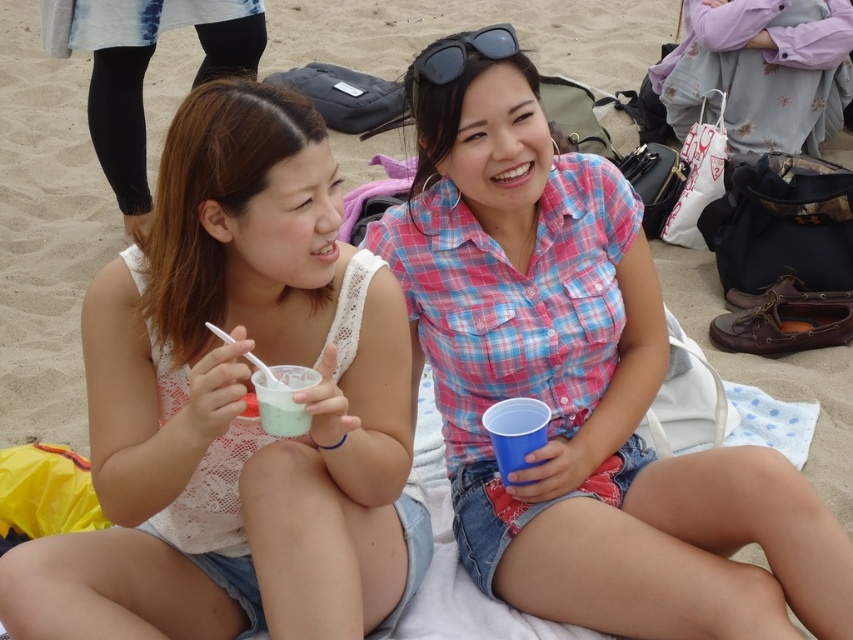
Question: Which point is farther to the camera?

Choices:
 (A) (148, 60)
 (B) (444, 65)

Answer: (A)

Question: Does white lace tank top at center come in front of matte white tank top at center?

Choices:
 (A) no
 (B) yes

Answer: (B)

Question: Can you confirm if white lace tank top at center is positioned above black plastic goggles at upper center?

Choices:
 (A) no
 (B) yes

Answer: (A)

Question: Which point is closer to the camera?

Choices:
 (A) (730, 472)
 (B) (437, 83)
 (C) (302, 422)

Answer: (C)

Question: Which object is the closest to the pink plaid shirt at center?

Choices:
 (A) matte white tank top at center
 (B) black plastic goggles at upper center

Answer: (B)

Question: Is white lace tank top at center smaller than white matte cup at center?

Choices:
 (A) yes
 (B) no

Answer: (B)